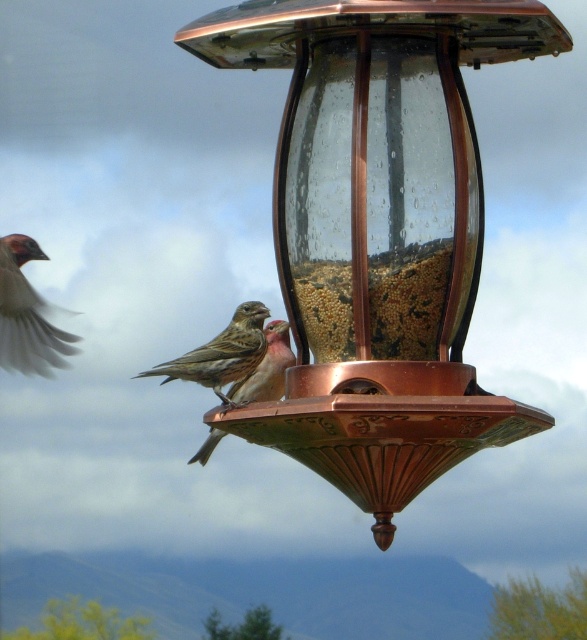
Which is below, copper glass bird feeder at center or brown matte sparrow at center?

Positioned lower is brown matte sparrow at center.

The image size is (587, 640). I want to click on copper glass bird feeder at center, so click(x=379, y=228).

Is point (346, 218) positioned behind point (151, 374)?

No, it is not.

I want to click on copper glass bird feeder at center, so click(x=379, y=228).

Which is in front, point (45, 356) or point (210, 433)?

Point (210, 433)

Who is lower down, white matte sparrow at left or brown speckled sparrow at center?

brown speckled sparrow at center is lower down.

The height and width of the screenshot is (640, 587). Identify the location of white matte sparrow at left. (26, 314).

Identify the location of white matte sparrow at left. The width and height of the screenshot is (587, 640). (26, 314).

Who is shorter, copper glass bird feeder at center or brown speckled sparrow at center?

Standing shorter between the two is copper glass bird feeder at center.

The height and width of the screenshot is (640, 587). Find the location of `copper glass bird feeder at center`. copper glass bird feeder at center is located at coordinates (379, 228).